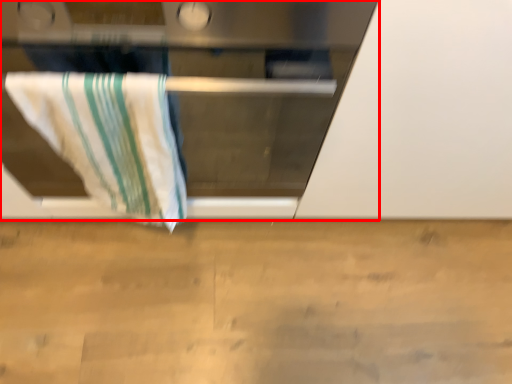
Question: From the image's perspective, what is the correct spatial relationship of oven (annotated by the red box) in relation to towel?

Choices:
 (A) below
 (B) above

Answer: (B)